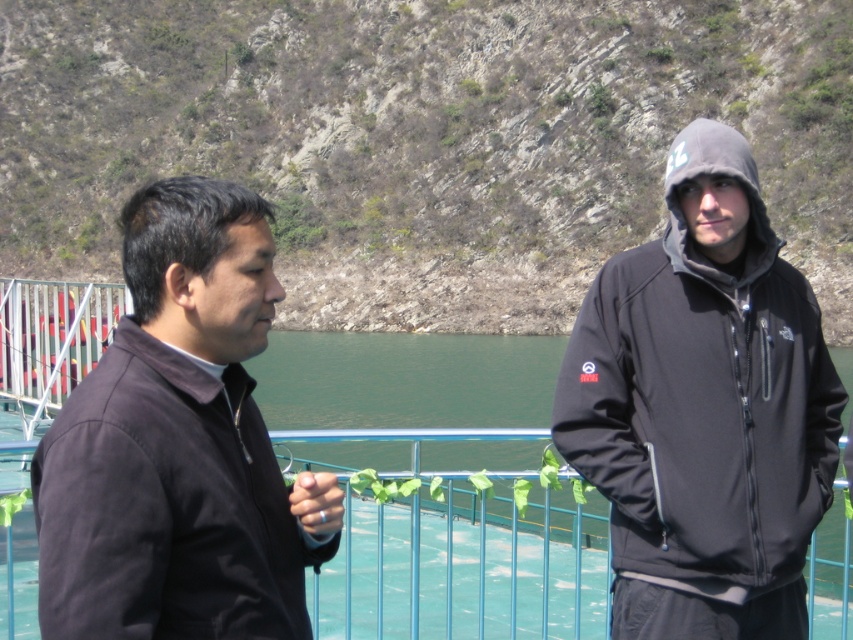
Does point (663, 236) lie behind point (86, 410)?

Yes.

Can you confirm if matte black hoodie at right is wider than dark matte jacket at left?

Incorrect, matte black hoodie at right's width does not surpass dark matte jacket at left's.

Between point (833, 401) and point (165, 486), which one is positioned in front?

Point (165, 486) is in front.

At what (x,y) coordinates should I click in order to perform the action: click on matte black hoodie at right. Please return your answer as a coordinate pair (x, y). The width and height of the screenshot is (853, 640). Looking at the image, I should click on (704, 408).